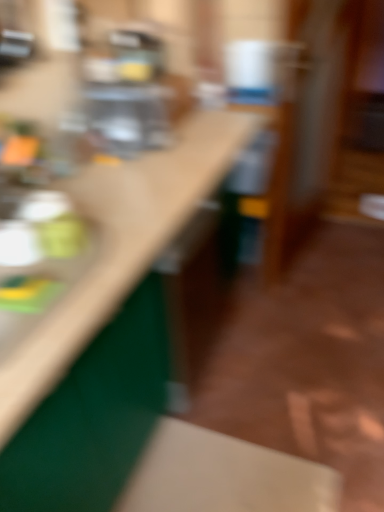
You are a GUI agent. You are given a task and a screenshot of the screen. Output one action in this format:
    pyautogui.click(x=<x>, y=<y>)
    Task: Click on the blank space situated above wooden at left (from a real-world perspective)
    
    Given the screenshot: What is the action you would take?
    pyautogui.click(x=121, y=177)